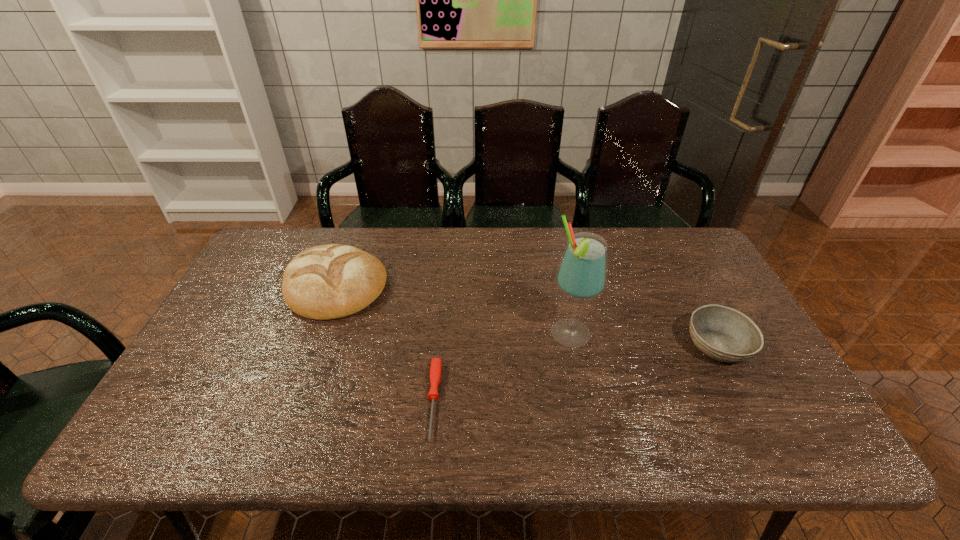
Find the location of a particular element. The image size is (960, 540). the tallest object is located at coordinates (582, 273).

Find the location of a particular element. This screenshot has height=540, width=960. alcohol is located at coordinates (582, 273).

Where is `bread`? The image size is (960, 540). bread is located at coordinates (330, 281).

This screenshot has height=540, width=960. I want to click on the leftmost object, so click(x=330, y=281).

At what (x,y) coordinates should I click in order to perform the action: click on the second shortest object. Please return your answer as a coordinate pair (x, y). Looking at the image, I should click on (724, 334).

Identify the location of bowl. (724, 334).

You are a GUI agent. You are given a task and a screenshot of the screen. Output one action in this format:
    pyautogui.click(x=<x>, y=<y>)
    Task: Click on the screwdriver
    
    Given the screenshot: What is the action you would take?
    pyautogui.click(x=435, y=369)

The height and width of the screenshot is (540, 960). In order to click on the shortest object in this screenshot , I will do `click(435, 369)`.

The width and height of the screenshot is (960, 540). In order to click on free space located on the back of the second object from right to left in this screenshot , I will do `click(559, 281)`.

You are a GUI agent. You are given a task and a screenshot of the screen. Output one action in this format:
    pyautogui.click(x=<x>, y=<y>)
    Task: Click on the vacant space located 0.160m on the right of the second tallest object
    
    Given the screenshot: What is the action you would take?
    pyautogui.click(x=439, y=286)